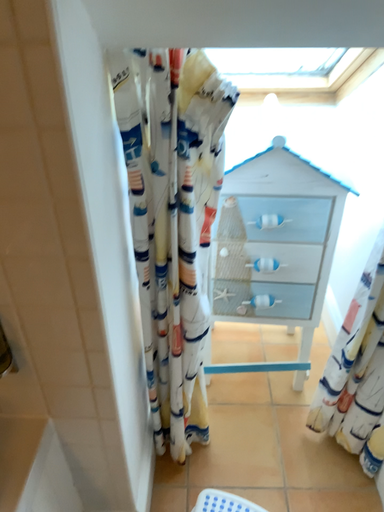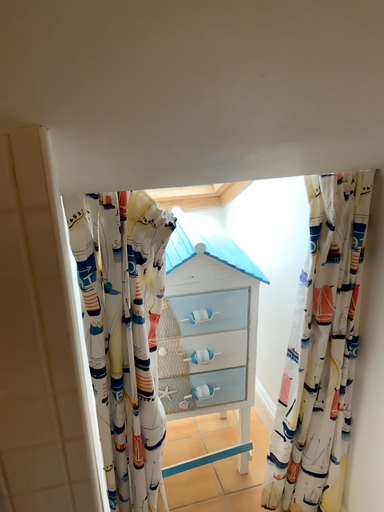
Question: How did the camera likely rotate when shooting the video?

Choices:
 (A) rotated downward
 (B) rotated upward

Answer: (B)